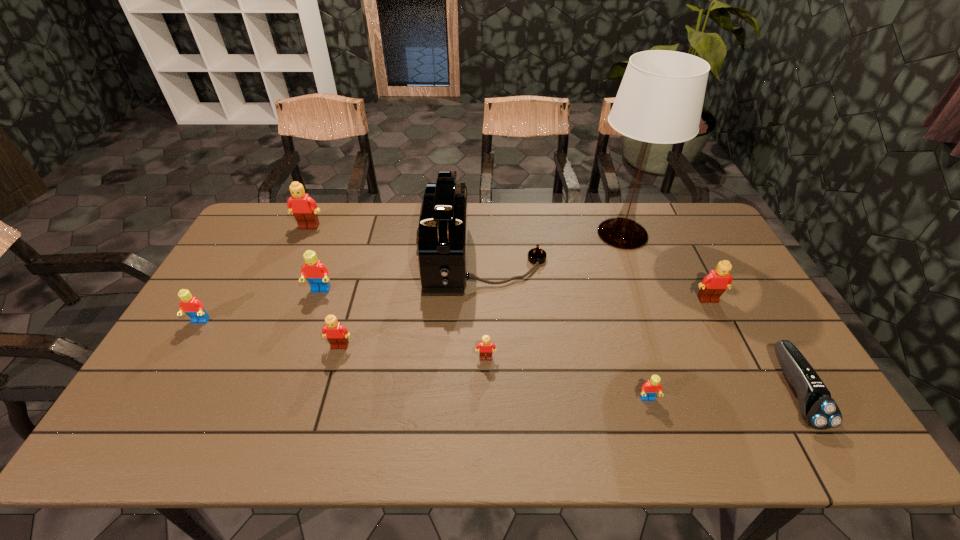
Locate an element on the screen. The width and height of the screenshot is (960, 540). free space located 0.100m on the front-facing side of the second tallest object is located at coordinates (393, 261).

This screenshot has width=960, height=540. In order to click on vacant space situated 0.210m on the face of the biggest brown Lego in this screenshot , I will do `click(289, 272)`.

Find the location of `vacant space located on the face of the farthest red Lego`. vacant space located on the face of the farthest red Lego is located at coordinates (276, 413).

Identify the location of vacant region located on the face of the second biggest brown Lego. (756, 394).

At what (x,y) coordinates should I click in order to perform the action: click on free space located 0.160m on the face of the fourth farthest Lego. Please return your answer as a coordinate pair (x, y). This screenshot has height=540, width=960. Looking at the image, I should click on pyautogui.click(x=168, y=376).

Image resolution: width=960 pixels, height=540 pixels. I want to click on vacant space located on the face of the seventh object from right to left, so click(x=322, y=412).

Locate an element on the screen. The width and height of the screenshot is (960, 540). vacant space located 0.090m on the face of the nearest red Lego is located at coordinates (660, 441).

Locate an element on the screen. Image resolution: width=960 pixels, height=540 pixels. free location located 0.120m on the face of the nearest brown Lego is located at coordinates (487, 403).

Find the location of a particular element. table lamp located at the far edge is located at coordinates (660, 99).

Where is `radio receiver that is positioned at the far edge`? radio receiver that is positioned at the far edge is located at coordinates (442, 235).